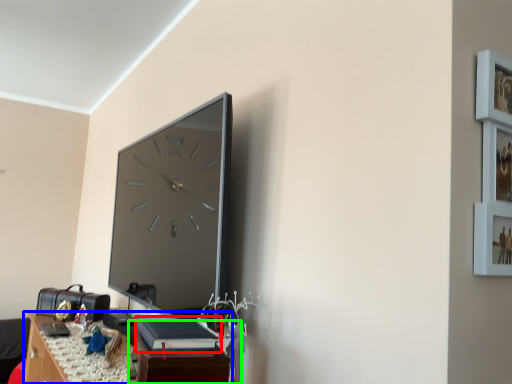
Question: Which is nearer to the book (highlighted by a red box)? table (highlighted by a blue box) or table (highlighted by a green box).

Choices:
 (A) table
 (B) table

Answer: (B)